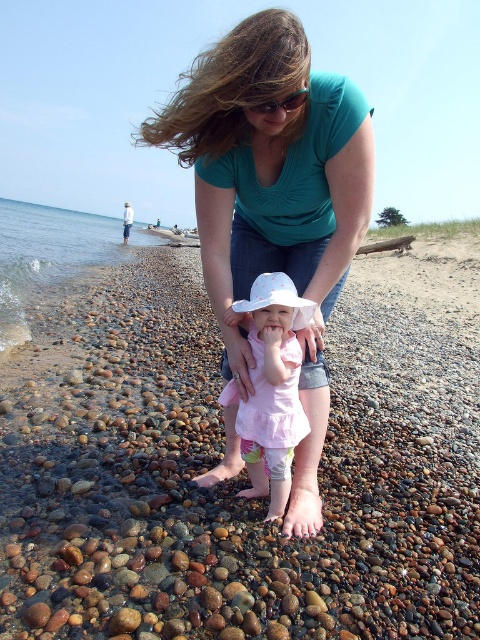
In the scene shown: You are a photographer trying to capture the scene of the woman and child on the beach. You need to position yourself so that the matte teal shirt at center and the clear water at lower left are both visible in your shot. Based on their positions, which object should be placed on the left side of your photo?

The clear water at lower left should be placed on the left side of your photo because the matte teal shirt at center is to the right of clear water at lower left, meaning the clear water is positioned to the left of the shirt.

You are a photographer trying to capture a photo of both the matte teal shirt at center and the pink fabric dress at center in the beach scene. To ensure both are fully visible in the frame, which object should you position closer to the camera to avoid cropping?

The matte teal shirt at center is wider than the pink fabric dress at center, so positioning the matte teal shirt at center closer to the camera would allow it to fit within the frame without cropping, as wider objects require more space when closer.

You are a photographer planning to capture the scene of the woman and child on the beach. You want to ensure that both the pink fabric dress at center and the clear water at lower left are visible in your shot. Which object should you focus on to ensure the other remains in frame?

Since the pink fabric dress at center is narrower than the clear water at lower left, you should focus on the pink fabric dress at center to ensure the wider clear water at lower left stays in frame.